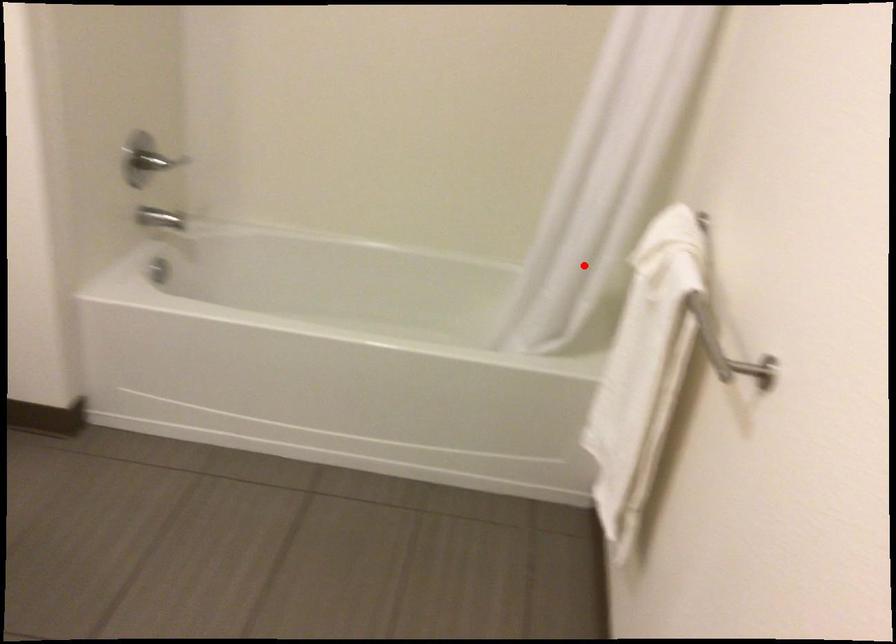
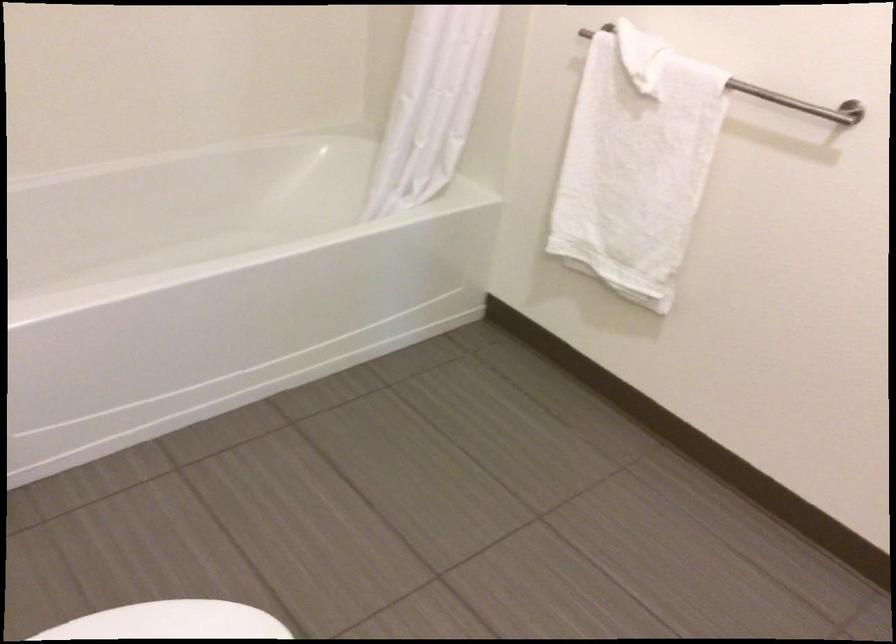
The point at the highlighted location is marked in the first image. Where is the corresponding point in the second image?

(431, 105)